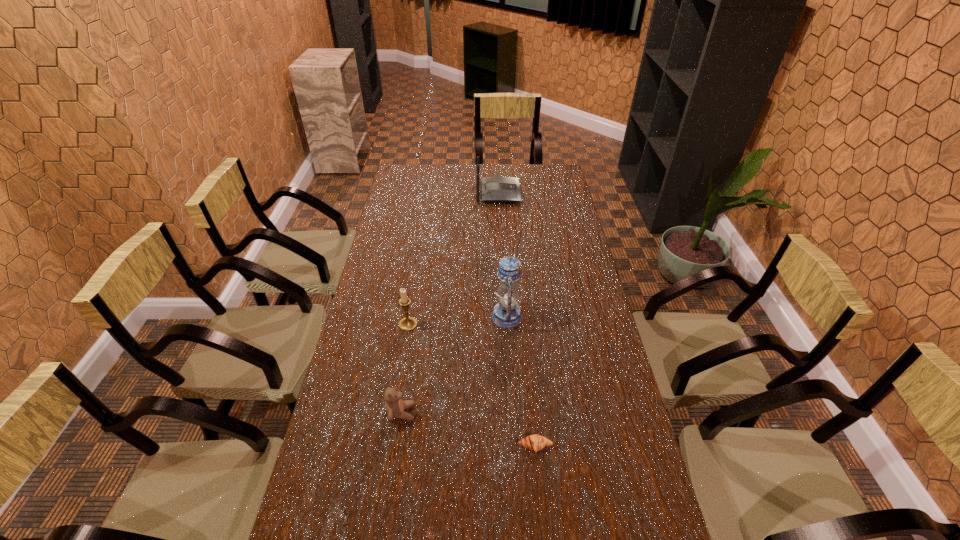
Where is `vacant space located 0.210m on the back of the candle holder`? The height and width of the screenshot is (540, 960). vacant space located 0.210m on the back of the candle holder is located at coordinates (416, 276).

I want to click on vacant region located 0.060m on the front-facing side of the router, so click(532, 193).

You are a GUI agent. You are given a task and a screenshot of the screen. Output one action in this format:
    pyautogui.click(x=<x>, y=<y>)
    Task: Click on the vacant space located 0.370m on the front-facing side of the second shortest object
    This screenshot has height=540, width=960.
    Given the screenshot: What is the action you would take?
    pyautogui.click(x=548, y=413)

At what (x,y) coordinates should I click in order to perform the action: click on vacant space positioned 0.170m on the front-facing side of the nearest object. Please return your answer as a coordinate pair (x, y). Looking at the image, I should click on (542, 525).

Identify the location of object present at the far edge. The height and width of the screenshot is (540, 960). (494, 189).

In order to click on candle holder present at the left edge in this screenshot , I will do `click(408, 323)`.

Locate an element on the screen. teddy bear located at the left edge is located at coordinates (395, 406).

Find the location of `free region at the far edge`. free region at the far edge is located at coordinates (433, 177).

At what (x,y) coordinates should I click in order to perform the action: click on vacant space at the left edge of the desktop. Please return your answer as a coordinate pair (x, y). Looking at the image, I should click on (409, 196).

Image resolution: width=960 pixels, height=540 pixels. What are the coordinates of `free location at the right edge` in the screenshot? It's located at (614, 436).